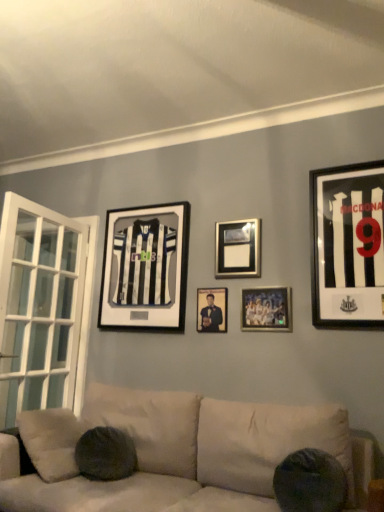
Find the location of `black and white jersey at upper center, acting as the 5th picture frame starting from the right`. black and white jersey at upper center, acting as the 5th picture frame starting from the right is located at coordinates (145, 269).

Where is `black matte jersey at right, the first picture frame from the right`? The width and height of the screenshot is (384, 512). black matte jersey at right, the first picture frame from the right is located at coordinates (347, 246).

What do you see at coordinates (347, 246) in the screenshot? I see `black matte jersey at right, the first picture frame from the right` at bounding box center [347, 246].

Image resolution: width=384 pixels, height=512 pixels. What do you see at coordinates (238, 249) in the screenshot?
I see `metallic silver picture frame at center, which ranks as the third picture frame in left-to-right order` at bounding box center [238, 249].

What are the coordinates of `black and white jersey at upper center, acting as the 5th picture frame starting from the right` in the screenshot? It's located at (145, 269).

Does black and white jersey at upper center, placed as the 1th picture frame when sorted from left to right, appear on the right side of black matte jersey at right, the first picture frame from the right?

Incorrect, black and white jersey at upper center, placed as the 1th picture frame when sorted from left to right, is not on the right side of black matte jersey at right, the first picture frame from the right.

Is black and white jersey at upper center, acting as the 5th picture frame starting from the right, bigger than black matte jersey at right, the 5th picture frame in the left-to-right sequence?

Indeed, black and white jersey at upper center, acting as the 5th picture frame starting from the right, has a larger size compared to black matte jersey at right, the 5th picture frame in the left-to-right sequence.

Is point (148, 222) less distant than point (359, 231)?

No, (148, 222) is behind (359, 231).

Locate an element on the screen. The image size is (384, 512). the 1st picture frame positioned below the black matte jersey at right, the first picture frame from the right (from a real-world perspective) is located at coordinates [x=145, y=269].

From the image's perspective, is black and white jersey at upper center, placed as the 1th picture frame when sorted from left to right, beneath metallic silver picture frame at center, acting as the 3th picture frame starting from the right?

Yes.

Is black and white jersey at upper center, acting as the 5th picture frame starting from the right, inside the boundaries of metallic silver picture frame at center, which ranks as the third picture frame in left-to-right order, or outside?

black and white jersey at upper center, acting as the 5th picture frame starting from the right, lies outside metallic silver picture frame at center, which ranks as the third picture frame in left-to-right order.

Find the location of a particular element. The image size is (384, 512). picture frame that is the 2nd one below the metallic silver picture frame at center, acting as the 3th picture frame starting from the right (from a real-world perspective) is located at coordinates (145, 269).

Is point (181, 237) closer to camera compared to point (241, 229)?

That is False.

Can you confirm if matte black portrait at center, marked as the 4th picture frame in a right-to-left arrangement, is taller than metallic silver picture frame at center, which ranks as the third picture frame in left-to-right order?

In fact, matte black portrait at center, marked as the 4th picture frame in a right-to-left arrangement, may be shorter than metallic silver picture frame at center, which ranks as the third picture frame in left-to-right order.

Is matte black portrait at center, marked as the 4th picture frame in a right-to-left arrangement, oriented towards metallic silver picture frame at center, which ranks as the third picture frame in left-to-right order?

No, matte black portrait at center, marked as the 4th picture frame in a right-to-left arrangement, is not oriented towards metallic silver picture frame at center, which ranks as the third picture frame in left-to-right order.

How distant is matte black portrait at center, the second picture frame positioned from the left, from metallic silver picture frame at center, acting as the 3th picture frame starting from the right?

matte black portrait at center, the second picture frame positioned from the left, is 11.11 inches from metallic silver picture frame at center, acting as the 3th picture frame starting from the right.

Does metallic silver picture frame at center, which ranks as the third picture frame in left-to-right order, have a lesser height compared to metallic silver photo frame at center, positioned as the 2th picture frame in right-to-left order?

In fact, metallic silver picture frame at center, which ranks as the third picture frame in left-to-right order, may be taller than metallic silver photo frame at center, positioned as the 2th picture frame in right-to-left order.

Is point (236, 262) less distant than point (246, 289)?

No, (236, 262) is further to viewer.

Is metallic silver picture frame at center, which ranks as the third picture frame in left-to-right order, oriented towards metallic silver photo frame at center, the fourth picture frame positioned from the left?

No.

Considering the sizes of metallic silver picture frame at center, acting as the 3th picture frame starting from the right, and metallic silver photo frame at center, positioned as the 2th picture frame in right-to-left order, in the image, is metallic silver picture frame at center, acting as the 3th picture frame starting from the right, bigger or smaller than metallic silver photo frame at center, positioned as the 2th picture frame in right-to-left order,?

In the image, metallic silver picture frame at center, acting as the 3th picture frame starting from the right, appears to be larger than metallic silver photo frame at center, positioned as the 2th picture frame in right-to-left order.

How different are the orientations of black matte jersey at right, the 5th picture frame in the left-to-right sequence, and matte black portrait at center, the second picture frame positioned from the left, in degrees?

The angular difference between black matte jersey at right, the 5th picture frame in the left-to-right sequence, and matte black portrait at center, the second picture frame positioned from the left, is 0.00398 degrees.

Does black matte jersey at right, the first picture frame from the right, have a lesser width compared to matte black portrait at center, marked as the 4th picture frame in a right-to-left arrangement?

In fact, black matte jersey at right, the first picture frame from the right, might be wider than matte black portrait at center, marked as the 4th picture frame in a right-to-left arrangement.

Would you say black matte jersey at right, the 5th picture frame in the left-to-right sequence, is outside matte black portrait at center, the second picture frame positioned from the left?

Absolutely, black matte jersey at right, the 5th picture frame in the left-to-right sequence, is external to matte black portrait at center, the second picture frame positioned from the left.

From a real-world perspective, which is physically above, black matte jersey at right, the 5th picture frame in the left-to-right sequence, or matte black portrait at center, marked as the 4th picture frame in a right-to-left arrangement?

black matte jersey at right, the 5th picture frame in the left-to-right sequence.

From a real-world perspective, is matte black portrait at center, the second picture frame positioned from the left, positioned above or below metallic silver photo frame at center, positioned as the 2th picture frame in right-to-left order?

From a real-world perspective, matte black portrait at center, the second picture frame positioned from the left, is physically below metallic silver photo frame at center, positioned as the 2th picture frame in right-to-left order.

Would you say matte black portrait at center, the second picture frame positioned from the left, is inside or outside metallic silver photo frame at center, the fourth picture frame positioned from the left?

matte black portrait at center, the second picture frame positioned from the left, lies outside metallic silver photo frame at center, the fourth picture frame positioned from the left.

From the picture: Does matte black portrait at center, the second picture frame positioned from the left, have a larger size compared to metallic silver photo frame at center, the fourth picture frame positioned from the left?

Actually, matte black portrait at center, the second picture frame positioned from the left, might be smaller than metallic silver photo frame at center, the fourth picture frame positioned from the left.

Consider the image. Is black matte jersey at right, the first picture frame from the right, facing towards metallic silver picture frame at center, which ranks as the third picture frame in left-to-right order?

No, black matte jersey at right, the first picture frame from the right, is not facing towards metallic silver picture frame at center, which ranks as the third picture frame in left-to-right order.

Are black matte jersey at right, the first picture frame from the right, and metallic silver picture frame at center, which ranks as the third picture frame in left-to-right order, located far from each other?

No, black matte jersey at right, the first picture frame from the right, is not far away from metallic silver picture frame at center, which ranks as the third picture frame in left-to-right order.

Is black matte jersey at right, the first picture frame from the right, shorter than metallic silver picture frame at center, which ranks as the third picture frame in left-to-right order?

Incorrect, the height of black matte jersey at right, the first picture frame from the right, does not fall short of that of metallic silver picture frame at center, which ranks as the third picture frame in left-to-right order.

Find the location of a particular element. the 2nd picture frame above the black and white jersey at upper center, placed as the 1th picture frame when sorted from left to right (from the image's perspective) is located at coordinates (347, 246).

There is a metallic silver picture frame at center, acting as the 3th picture frame starting from the right. Where is `the 2nd picture frame below it (from a real-world perspective)`? This screenshot has height=512, width=384. the 2nd picture frame below it (from a real-world perspective) is located at coordinates (145, 269).

Looking at the image, which one is located closer to metallic silver photo frame at center, the fourth picture frame positioned from the left, metallic silver picture frame at center, which ranks as the third picture frame in left-to-right order, or black and white jersey at upper center, acting as the 5th picture frame starting from the right?

metallic silver picture frame at center, which ranks as the third picture frame in left-to-right order, is positioned closer to the anchor metallic silver photo frame at center, the fourth picture frame positioned from the left.

Which object lies nearer to the anchor point metallic silver photo frame at center, positioned as the 2th picture frame in right-to-left order, black matte jersey at right, the 5th picture frame in the left-to-right sequence, or metallic silver picture frame at center, which ranks as the third picture frame in left-to-right order?

metallic silver picture frame at center, which ranks as the third picture frame in left-to-right order.

Estimate the real-world distances between objects in this image. Which object is further from black and white jersey at upper center, placed as the 1th picture frame when sorted from left to right, metallic silver photo frame at center, the fourth picture frame positioned from the left, or black matte jersey at right, the 5th picture frame in the left-to-right sequence?

Based on the image, black matte jersey at right, the 5th picture frame in the left-to-right sequence, appears to be further to black and white jersey at upper center, placed as the 1th picture frame when sorted from left to right.

From the image, which object appears to be nearer to matte black portrait at center, marked as the 4th picture frame in a right-to-left arrangement, metallic silver picture frame at center, which ranks as the third picture frame in left-to-right order, or black and white jersey at upper center, placed as the 1th picture frame when sorted from left to right?

Based on the image, metallic silver picture frame at center, which ranks as the third picture frame in left-to-right order, appears to be nearer to matte black portrait at center, marked as the 4th picture frame in a right-to-left arrangement.

Which object lies nearer to the anchor point black matte jersey at right, the 5th picture frame in the left-to-right sequence, black and white jersey at upper center, placed as the 1th picture frame when sorted from left to right, or matte black portrait at center, the second picture frame positioned from the left?

matte black portrait at center, the second picture frame positioned from the left.

Considering their positions, is black and white jersey at upper center, acting as the 5th picture frame starting from the right, positioned further to metallic silver photo frame at center, the fourth picture frame positioned from the left, than matte black portrait at center, marked as the 4th picture frame in a right-to-left arrangement?

black and white jersey at upper center, acting as the 5th picture frame starting from the right.

Which object lies nearer to the anchor point black matte jersey at right, the first picture frame from the right, metallic silver picture frame at center, which ranks as the third picture frame in left-to-right order, or matte black portrait at center, the second picture frame positioned from the left?

Based on the image, metallic silver picture frame at center, which ranks as the third picture frame in left-to-right order, appears to be nearer to black matte jersey at right, the first picture frame from the right.

Based on their spatial positions, is metallic silver picture frame at center, acting as the 3th picture frame starting from the right, or black matte jersey at right, the 5th picture frame in the left-to-right sequence, closer to matte black portrait at center, the second picture frame positioned from the left?

metallic silver picture frame at center, acting as the 3th picture frame starting from the right.

Where is `picture frame situated between metallic silver picture frame at center, which ranks as the third picture frame in left-to-right order, and black matte jersey at right, the first picture frame from the right, from left to right`? The width and height of the screenshot is (384, 512). picture frame situated between metallic silver picture frame at center, which ranks as the third picture frame in left-to-right order, and black matte jersey at right, the first picture frame from the right, from left to right is located at coordinates (267, 309).

Where is `picture frame situated between black and white jersey at upper center, placed as the 1th picture frame when sorted from left to right, and metallic silver picture frame at center, which ranks as the third picture frame in left-to-right order, from left to right`? picture frame situated between black and white jersey at upper center, placed as the 1th picture frame when sorted from left to right, and metallic silver picture frame at center, which ranks as the third picture frame in left-to-right order, from left to right is located at coordinates (x=212, y=310).